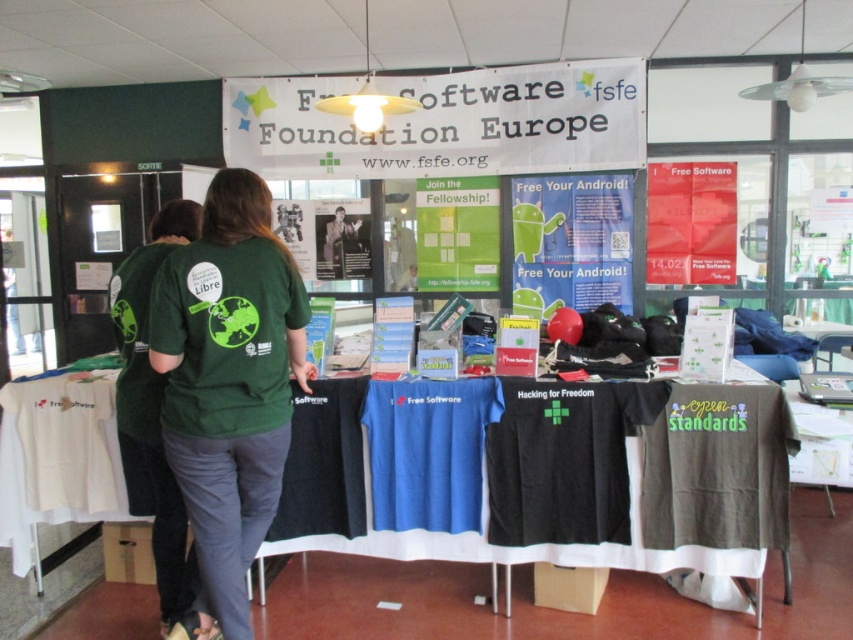
Does green fabric shirt at left have a smaller size compared to matte black t-shirt at center?

No.

Is green fabric shirt at left above matte black t-shirt at center?

No, green fabric shirt at left is not above matte black t-shirt at center.

Does point (119, 438) come farther from viewer compared to point (325, 252)?

No, it is in front of (325, 252).

Locate an element on the screen. This screenshot has width=853, height=640. green fabric shirt at left is located at coordinates (152, 412).

Measure the distance between green paper poster at center and matte black t-shirt at center.

They are 27.23 inches apart.

Is green paper poster at center further to camera compared to matte black t-shirt at center?

No, it is in front of matte black t-shirt at center.

What do you see at coordinates (457, 234) in the screenshot?
I see `green paper poster at center` at bounding box center [457, 234].

What are the coordinates of `green paper poster at center` in the screenshot? It's located at (457, 234).

Who is positioned more to the right, blue paper poster at center or green paper poster at center?

blue paper poster at center is more to the right.

Based on the photo, between blue paper poster at center and green paper poster at center, which one has less height?

Standing shorter between the two is green paper poster at center.

Where is `blue paper poster at center`? blue paper poster at center is located at coordinates (572, 243).